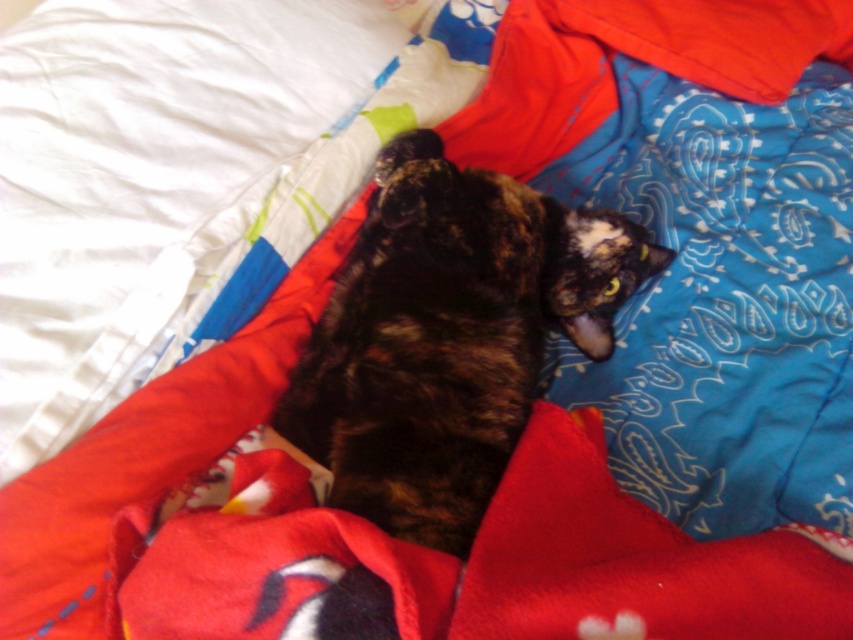
You are trying to decide whether to place a new decorative item on the bed. The item is 15 inches wide. Based on the scene, can the white soft pillow at upper left accommodate this item next to the shiny tortoiseshell cat at center?

The white soft pillow at upper left is wider than the shiny tortoiseshell cat at center. Since the item is 15 inches wide, and the pillow is wider than the cat, it might have enough space. However, without knowing the exact dimensions of the pillow, it is uncertain. But since the pillow is wider than the cat, there is a possibility that the item could fit next to the cat on the pillow.

You are holding a camera and want to take a photo of the cat lying on the bed. The camera is currently positioned where the white soft pillow at upper left is located. Can you move the camera closer to the cat without moving the pillow? Explain your reasoning.

The white soft pillow at upper left and camera are 27.82 inches apart from each other. Since the camera is at the same position as the pillow, you cannot move it closer to the cat without moving the pillow because they are currently separated by that distance.